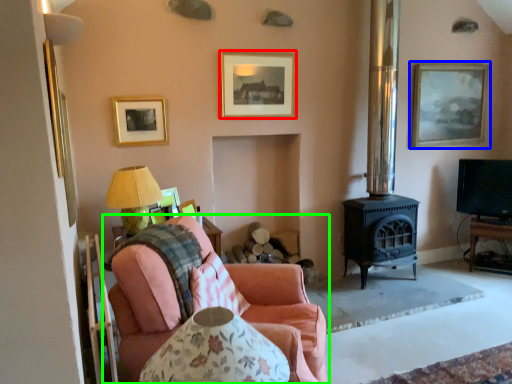
Question: Considering the real-world distances, which object is farthest from picture frame (highlighted by a red box)? picture frame (highlighted by a blue box) or studio couch (highlighted by a green box)?

Choices:
 (A) picture frame
 (B) studio couch

Answer: (A)